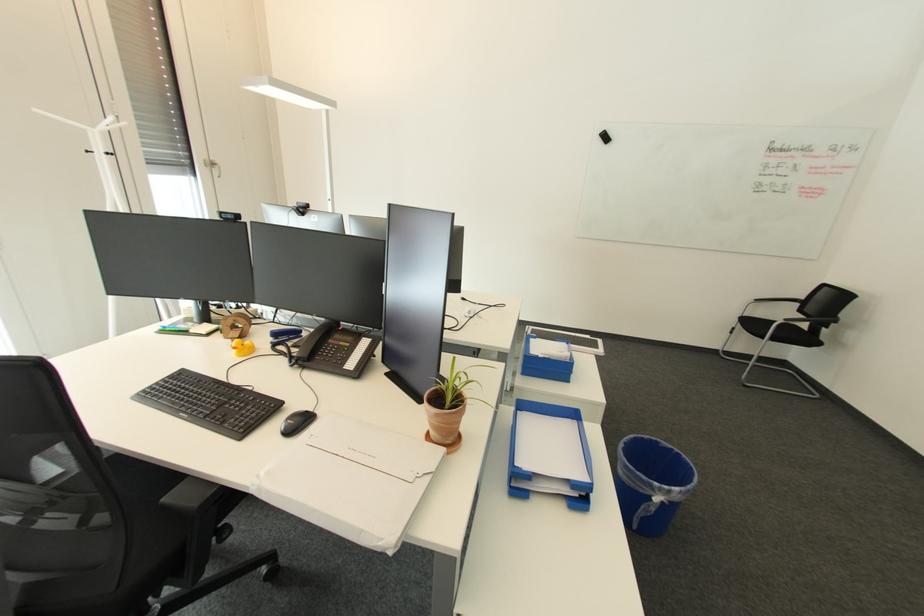
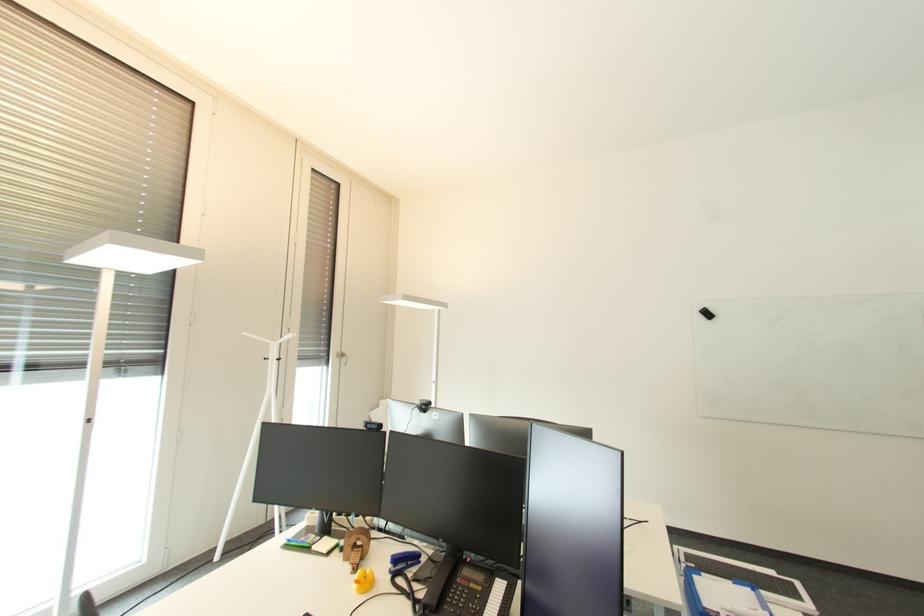
Consider the image. Which direction would the cameraman need to move to produce the second image?

The cameraman moved toward left, backward.